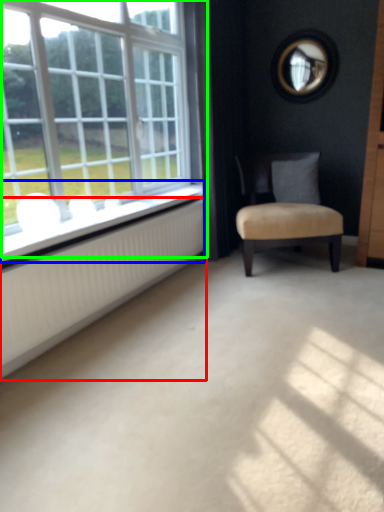
Question: Which object is the closest to the radiator (highlighted by a red box)? Choose among these: window sill (highlighted by a blue box) or window (highlighted by a green box).

Choices:
 (A) window sill
 (B) window

Answer: (A)